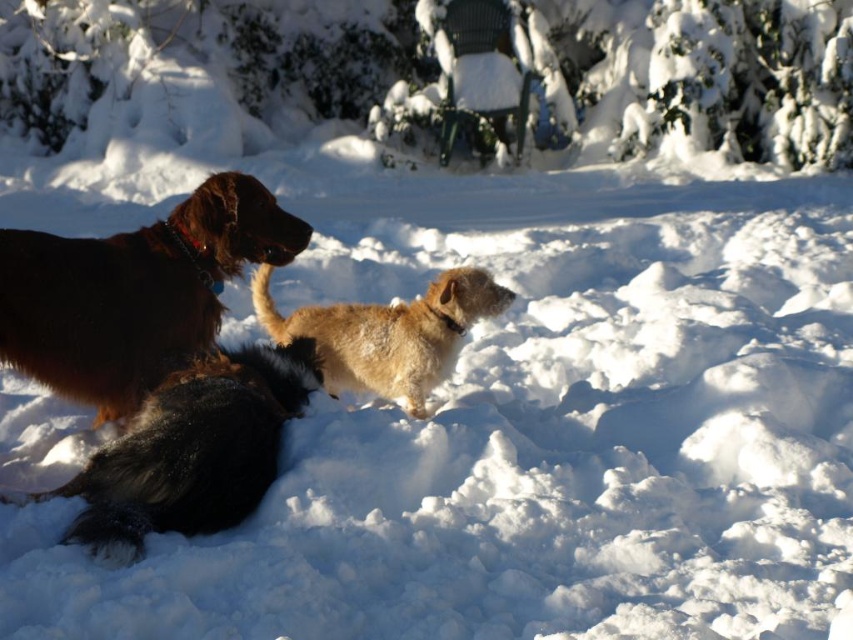
Question: Is shiny brown fur at left to the right of black fluffy dog at left from the viewer's perspective?

Choices:
 (A) no
 (B) yes

Answer: (A)

Question: Can you confirm if black fluffy dog at left is smaller than fuzzy brown dog at center?

Choices:
 (A) no
 (B) yes

Answer: (A)

Question: Which of the following is the farthest from the observer?

Choices:
 (A) fuzzy brown dog at center
 (B) black fluffy dog at left
 (C) shiny brown fur at left

Answer: (A)

Question: Estimate the real-world distances between objects in this image. Which object is farther from the shiny brown fur at left?

Choices:
 (A) black fluffy dog at left
 (B) fuzzy brown dog at center

Answer: (B)

Question: Which point is closer to the camera?

Choices:
 (A) (431, 321)
 (B) (86, 483)

Answer: (B)

Question: Is shiny brown fur at left positioned in front of fuzzy brown dog at center?

Choices:
 (A) no
 (B) yes

Answer: (B)